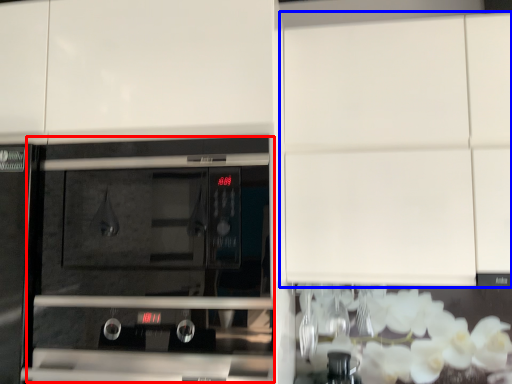
Question: Which of the following is the farthest to the observer, oven (highlighted by a red box) or cabinetry (highlighted by a blue box)?

Choices:
 (A) oven
 (B) cabinetry

Answer: (B)